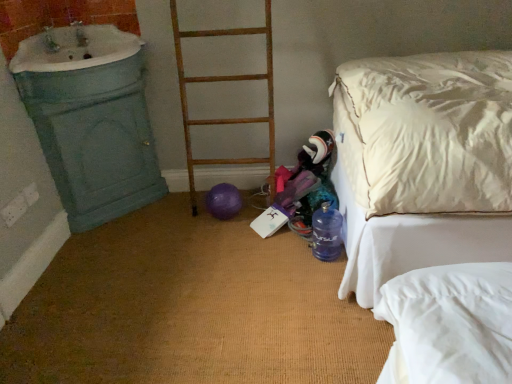
The height and width of the screenshot is (384, 512). I want to click on vacant space in front of rusty wood ladder at center, so click(224, 237).